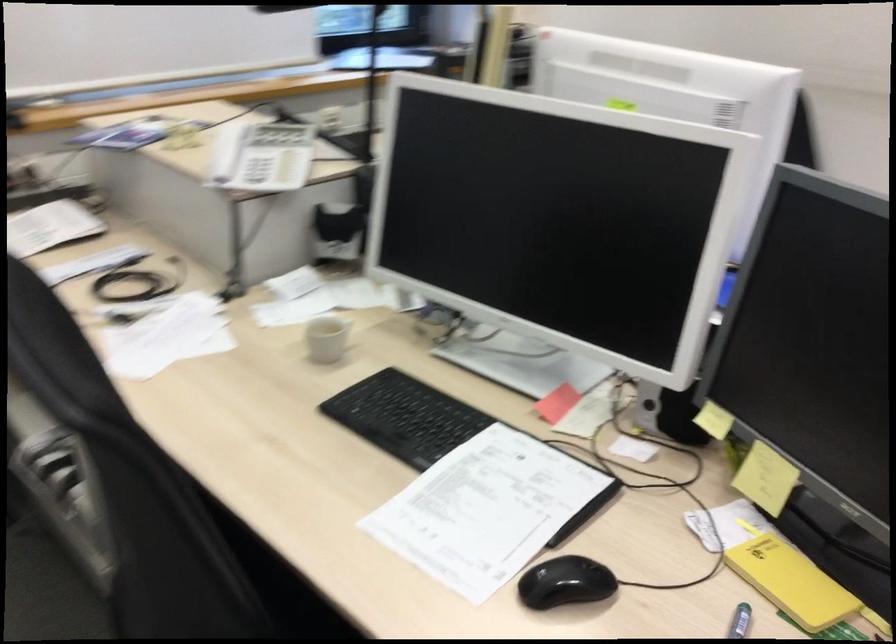
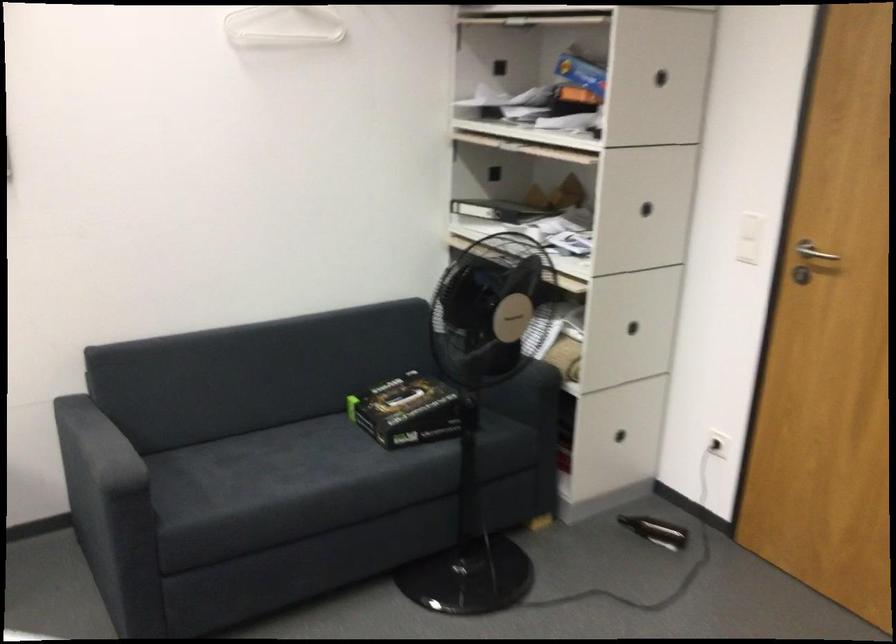
Question: The first image is from the beginning of the video and the second image is from the end. How did the camera likely rotate when shooting the video?

Choices:
 (A) Left
 (B) Right
 (C) Up
 (D) Down

Answer: (B)